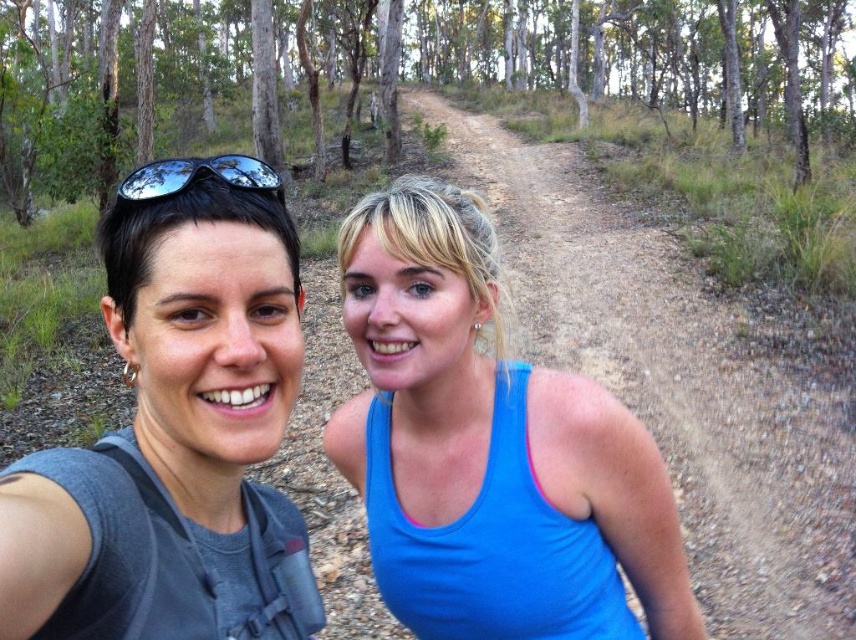
You are standing at the center of the dirt path in the forest. You see a point marked at coordinates (489, 449). What object is located at that point?

The point at coordinates (489, 449) indicates the blue fabric tank top at center.